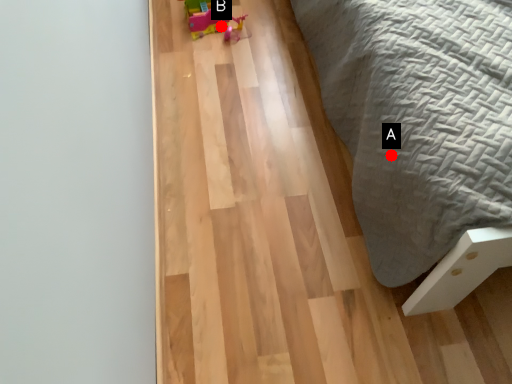
Question: Two points are circled on the image, labeled by A and B beside each circle. Which point is closer to the camera taking this photo?

Choices:
 (A) A is closer
 (B) B is closer

Answer: (A)